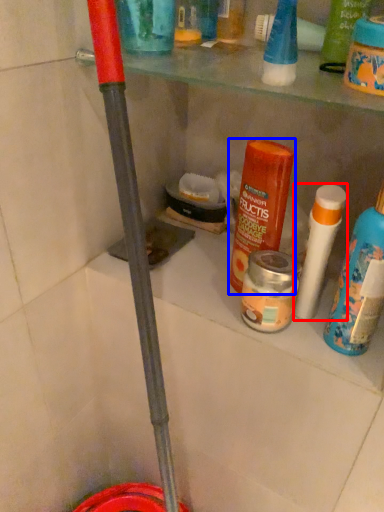
Question: Which object appears farthest to the camera in this image, cleaning product (highlighted by a red box) or product (highlighted by a blue box)?

Choices:
 (A) cleaning product
 (B) product

Answer: (B)